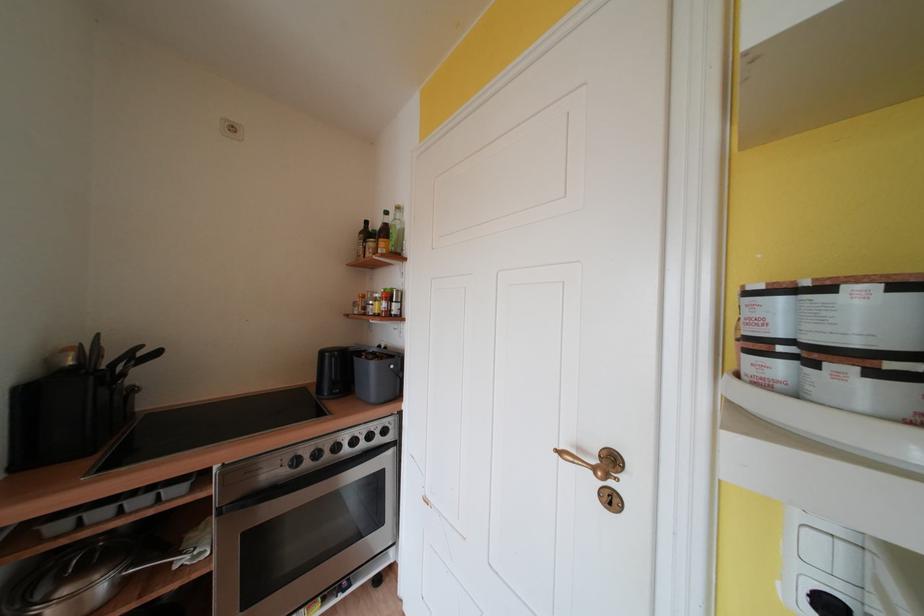
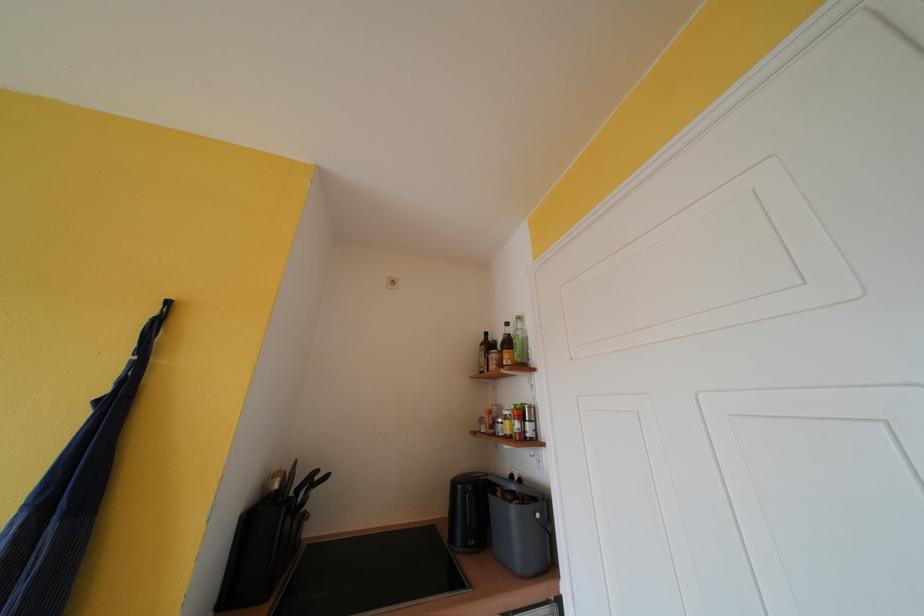
The images are taken continuously from a first-person perspective. In which direction is your viewpoint rotating?

The camera's rotation is toward left-up.